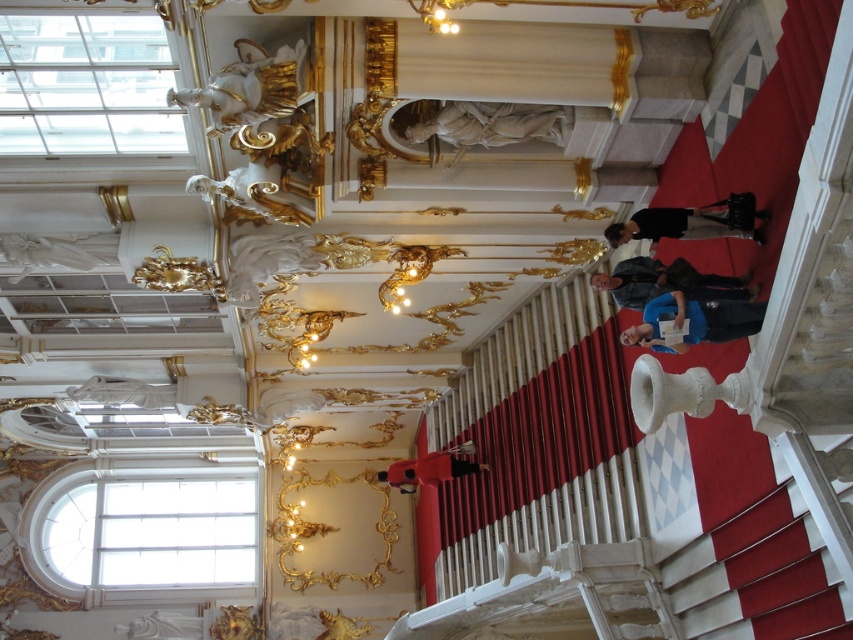
Between white marble statue at upper center and black leather bag at center, which one appears on the left side from the viewer's perspective?

From the viewer's perspective, white marble statue at upper center appears more on the left side.

Image resolution: width=853 pixels, height=640 pixels. What do you see at coordinates (492, 124) in the screenshot? I see `white marble statue at upper center` at bounding box center [492, 124].

Where is `white marble statue at upper center`? This screenshot has height=640, width=853. white marble statue at upper center is located at coordinates (492, 124).

Which is above, blue fabric at center or black leather bag at center?

black leather bag at center

At what (x,y) coordinates should I click in order to perform the action: click on blue fabric at center. Please return your answer as a coordinate pair (x, y). This screenshot has width=853, height=640. Looking at the image, I should click on (692, 323).

Who is higher up, white marble statue at upper center or blue fabric at center?

white marble statue at upper center

Which is in front, point (572, 115) or point (677, 296)?

Point (677, 296)

The image size is (853, 640). Identify the location of white marble statue at upper center. pyautogui.click(x=492, y=124).

Locate an element on the screen. white marble statue at upper center is located at coordinates (492, 124).